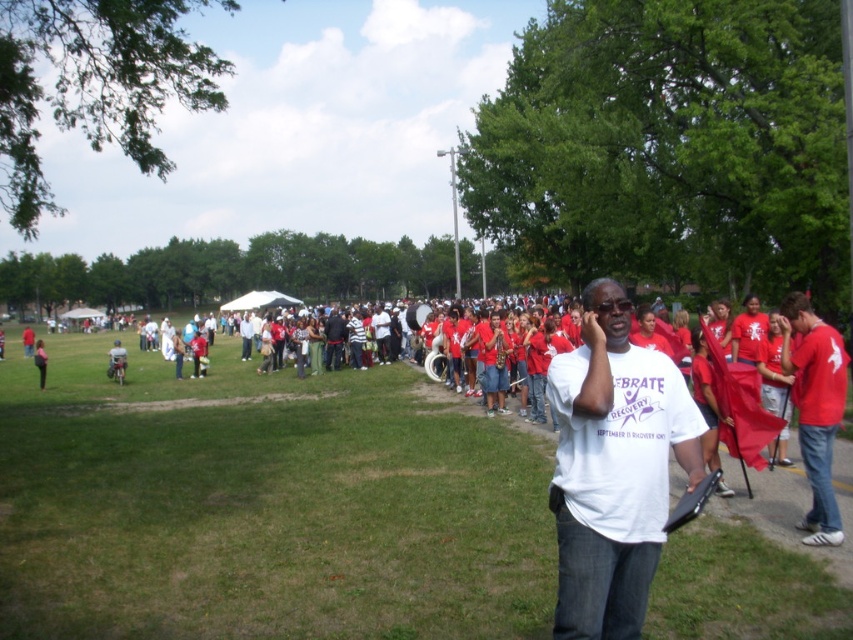
Question: Is white cotton t-shirt at center thinner than white matte t-shirt at center?

Choices:
 (A) no
 (B) yes

Answer: (A)

Question: Can you confirm if white cotton t-shirt at center is positioned below matte red shirt at right?

Choices:
 (A) no
 (B) yes

Answer: (B)

Question: Can you confirm if white cotton t-shirt at center is positioned above white matte t-shirt at center?

Choices:
 (A) no
 (B) yes

Answer: (A)

Question: Considering the real-world distances, which object is closest to the white cotton t-shirt at center?

Choices:
 (A) white matte t-shirt at center
 (B) matte red shirt at right

Answer: (B)

Question: Which object is the farthest from the matte red shirt at right?

Choices:
 (A) white matte t-shirt at center
 (B) white cotton t-shirt at center

Answer: (B)

Question: Among these objects, which one is farthest from the camera?

Choices:
 (A) matte red shirt at right
 (B) white cotton t-shirt at center

Answer: (A)